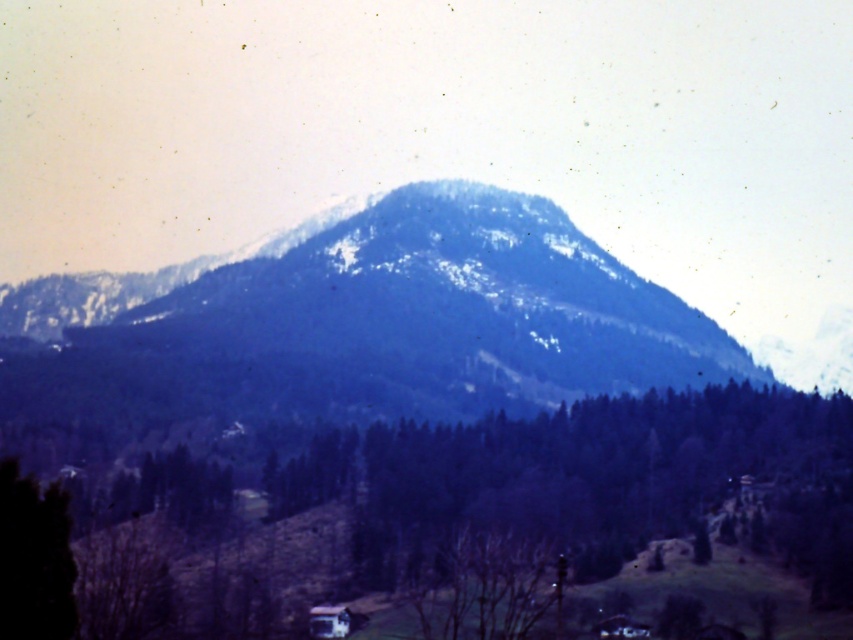
You are a hiker planning to take a photo of the snowy forested mountain at center. You want to position yourself so that the mountain is exactly in the center of your camera frame. What coordinates should you aim for?

You should aim for the coordinates point (372, 324) to center the snowy forested mountain at center in your camera frame.

You are an outdoor enthusiast planning a hike and see the image. You notice the green matte tree at center and the snowy forested mountain at center. Which object would appear closer to you in the scene?

The green matte tree at center appears closer because it is larger in size than the snowy forested mountain at center, indicating it is nearer to the observer.

You are an outdoor photographer planning to take a photo of the green matte tree at center and the green matte tree at lower left. Which tree will appear closer to the camera in the photo?

The green matte tree at center will appear closer to the camera because the green matte tree at lower left is behind it.